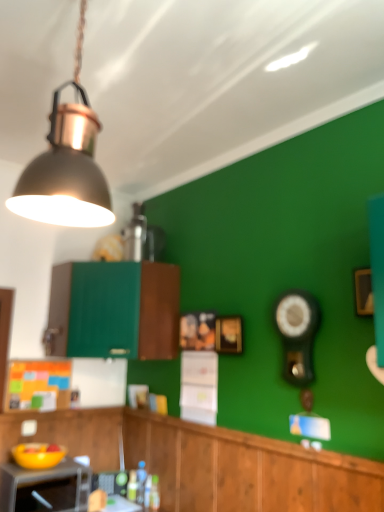
Question: Is black glossy clock at right turned away from green matte cabinet at center, marked as the first cabinetry in a top-to-bottom arrangement?

Choices:
 (A) yes
 (B) no

Answer: (B)

Question: Would you consider black glossy clock at right to be distant from green matte cabinet at center, acting as the second cabinetry starting from the bottom?

Choices:
 (A) yes
 (B) no

Answer: (B)

Question: Does black glossy clock at right have a larger size compared to green matte cabinet at center, marked as the first cabinetry in a top-to-bottom arrangement?

Choices:
 (A) yes
 (B) no

Answer: (B)

Question: From a real-world perspective, is black glossy clock at right over green matte cabinet at center, marked as the first cabinetry in a top-to-bottom arrangement?

Choices:
 (A) yes
 (B) no

Answer: (B)

Question: Would you say green matte cabinet at center, marked as the first cabinetry in a top-to-bottom arrangement, is part of black glossy clock at right's contents?

Choices:
 (A) no
 (B) yes

Answer: (A)

Question: Can you confirm if black glossy clock at right is positioned to the right of green matte cabinet at center, acting as the second cabinetry starting from the bottom?

Choices:
 (A) yes
 (B) no

Answer: (A)

Question: From a real-world perspective, does black glossy clock at right stand above matte black microwave at lower left?

Choices:
 (A) no
 (B) yes

Answer: (B)

Question: Is there a large distance between black glossy clock at right and matte black microwave at lower left?

Choices:
 (A) no
 (B) yes

Answer: (B)

Question: From the image's perspective, does black glossy clock at right appear lower than matte black microwave at lower left?

Choices:
 (A) yes
 (B) no

Answer: (B)

Question: Considering the relative sizes of black glossy clock at right and matte black microwave at lower left in the image provided, is black glossy clock at right wider than matte black microwave at lower left?

Choices:
 (A) no
 (B) yes

Answer: (A)

Question: Is black glossy clock at right to the left of matte black microwave at lower left from the viewer's perspective?

Choices:
 (A) no
 (B) yes

Answer: (A)

Question: From a real-world perspective, is black glossy clock at right physically below matte black microwave at lower left?

Choices:
 (A) yes
 (B) no

Answer: (B)

Question: Considering the relative sizes of matte black microwave at lower left and black glossy clock at right in the image provided, is matte black microwave at lower left taller than black glossy clock at right?

Choices:
 (A) yes
 (B) no

Answer: (B)